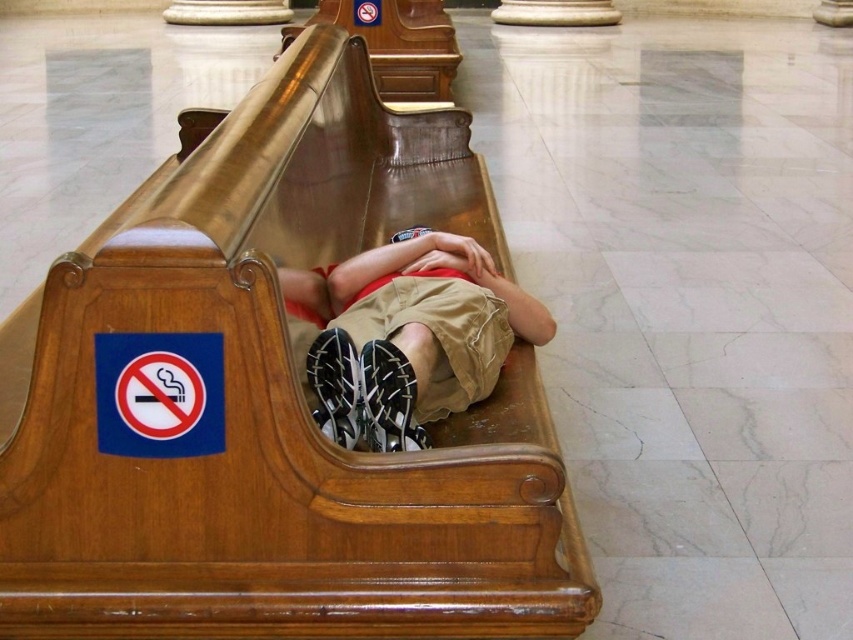
You are a maintenance worker checking the seating area. The polished wood church bench at center needs to accommodate the khaki cotton shorts at center. Can you confirm if the bench is wide enough?

The polished wood church bench at center might be wider than khaki cotton shorts at center, so it is possible that the bench can accommodate the khaki cotton shorts at center.